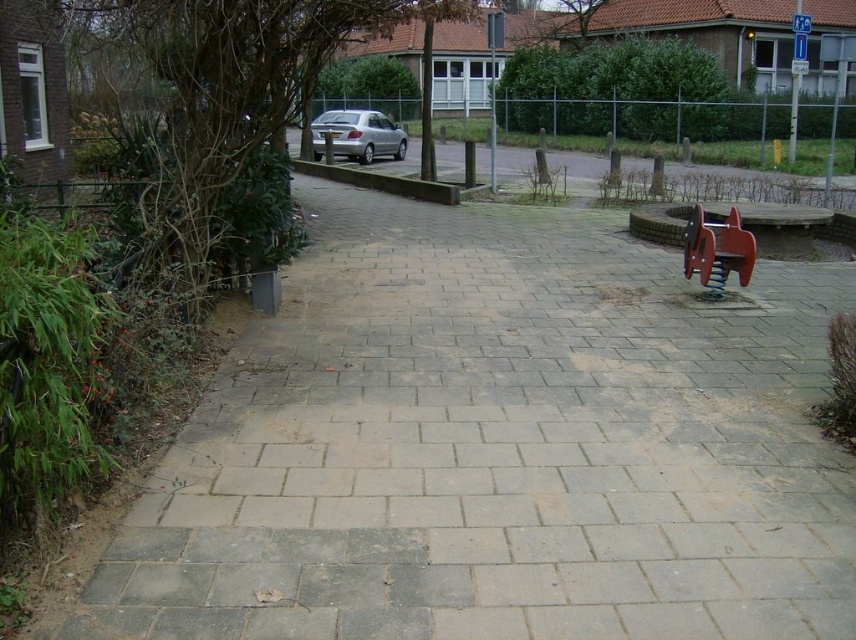
Does gray concrete pavement at left lie in front of silver metallic car at center?

Yes.

Is point (789, 291) in front of point (354, 125)?

Yes, it is.

Where is `gray concrete pavement at left`? Image resolution: width=856 pixels, height=640 pixels. gray concrete pavement at left is located at coordinates (497, 448).

Does gray concrete pavement at left have a greater height compared to metallic red swing set at right?

Incorrect, gray concrete pavement at left's height is not larger of metallic red swing set at right's.

Who is more forward, (235, 516) or (718, 296)?

Point (235, 516) is more forward.

You are a GUI agent. You are given a task and a screenshot of the screen. Output one action in this format:
    pyautogui.click(x=<x>, y=<y>)
    Task: Click on the gray concrete pavement at left
    This screenshot has width=856, height=640.
    Given the screenshot: What is the action you would take?
    pyautogui.click(x=497, y=448)

Does metallic red swing set at right have a greater width compared to silver metallic car at center?

No, metallic red swing set at right is not wider than silver metallic car at center.

Which is above, metallic red swing set at right or silver metallic car at center?

silver metallic car at center is above.

Locate an element on the screen. This screenshot has height=640, width=856. metallic red swing set at right is located at coordinates (717, 250).